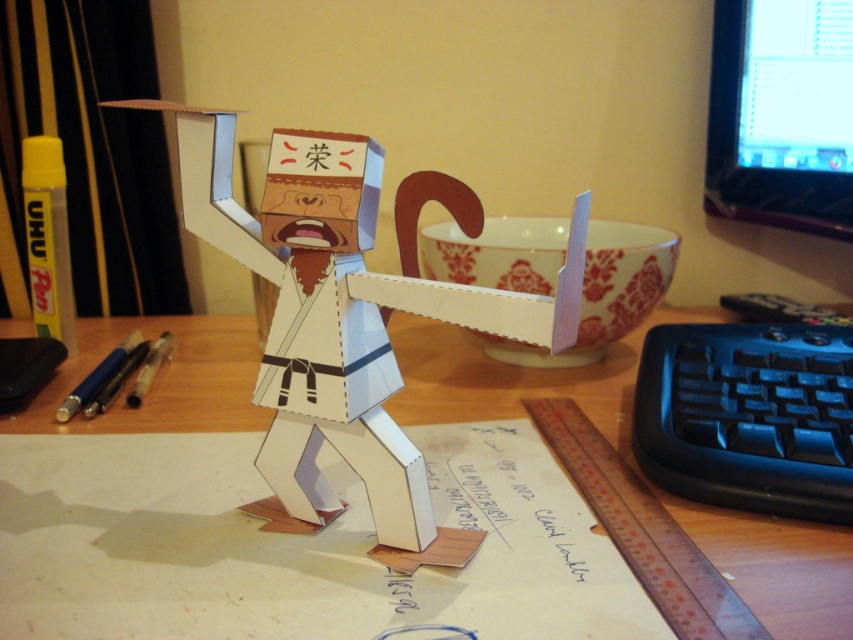
Question: Among these points, which one is nearest to the camera?

Choices:
 (A) (119, 356)
 (B) (840, 38)
 (C) (454, 356)

Answer: (A)

Question: Is cardboard paper doll at center thinner than black glossy monitor at upper right?

Choices:
 (A) yes
 (B) no

Answer: (B)

Question: Is black plastic keyboard at lower right thinner than translucent blue pen at lower left?

Choices:
 (A) no
 (B) yes

Answer: (A)

Question: Can you confirm if wooden desk at center is positioned above black glossy monitor at upper right?

Choices:
 (A) no
 (B) yes

Answer: (A)

Question: Which is farther from the wooden desk at center?

Choices:
 (A) black plastic keyboard at lower right
 (B) black glossy monitor at upper right

Answer: (B)

Question: Which of these objects is positioned closest to the black glossy monitor at upper right?

Choices:
 (A) cardboard paper doll at center
 (B) translucent blue pen at lower left

Answer: (A)